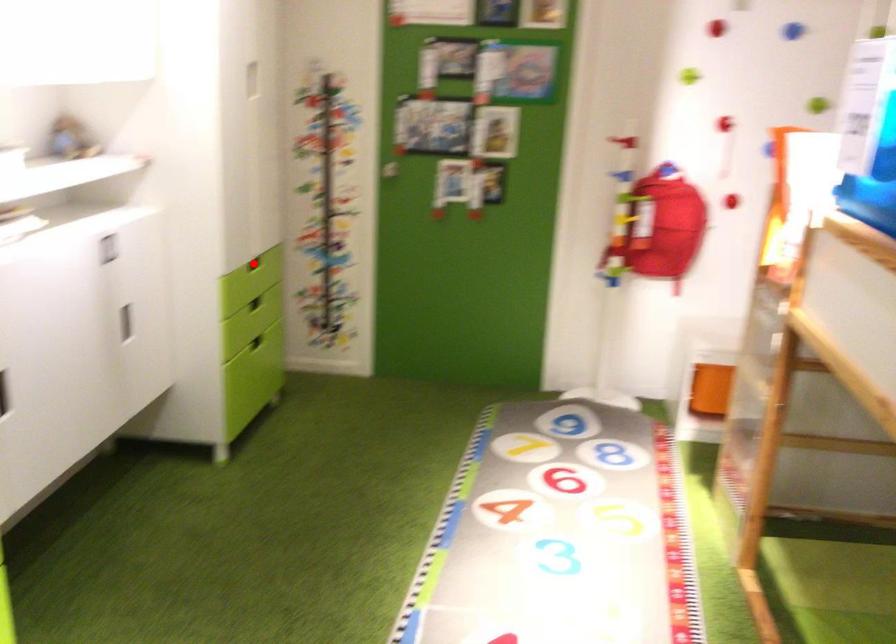
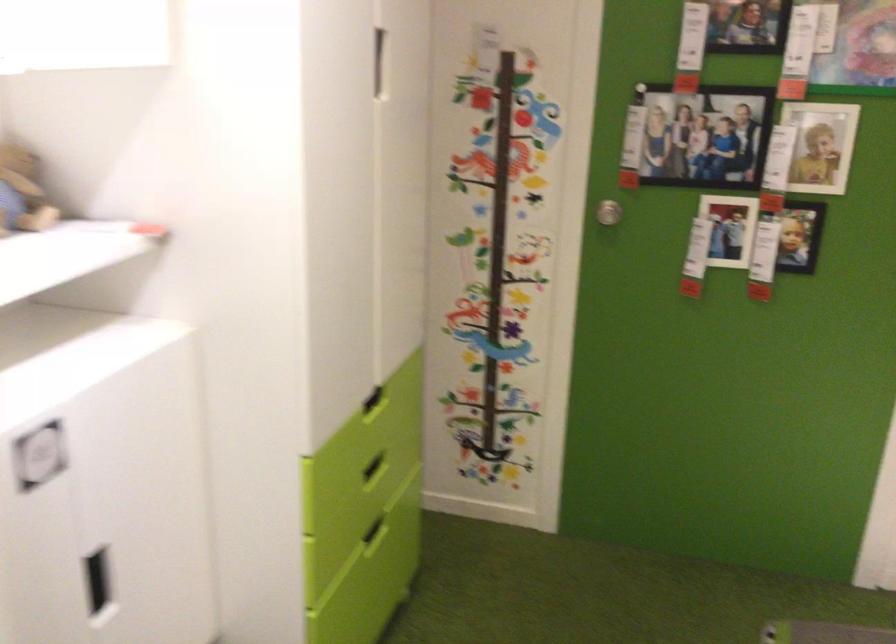
Question: I am providing you with two images of the same scene from different viewpoints. A red point is marked on the first image. Can you still see the location of the red point in image 2?

Choices:
 (A) Yes
 (B) No

Answer: (B)